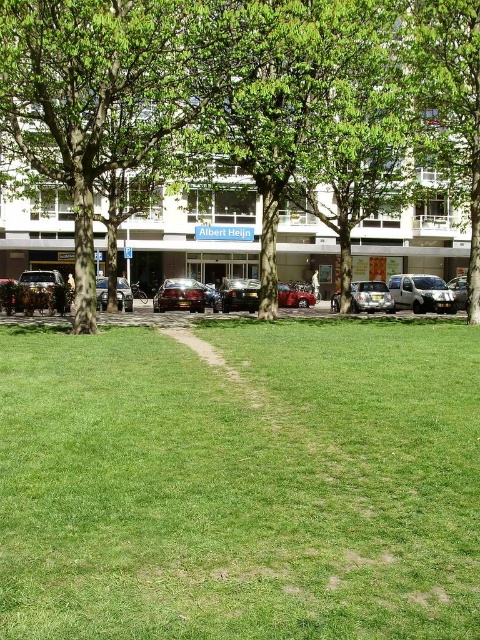
Does shiny silver car at center come in front of shiny silver sedan at center?

Yes, shiny silver car at center is in front of shiny silver sedan at center.

Who is lower down, shiny silver car at center or shiny silver sedan at center?

Positioned lower is shiny silver sedan at center.

Does point (362, 300) come closer to viewer compared to point (106, 282)?

Yes, it is in front of point (106, 282).

Where is `shiny silver car at center`? The width and height of the screenshot is (480, 640). shiny silver car at center is located at coordinates (371, 296).

Can you confirm if metallic silver van at center is positioned to the left of shiny silver car at center?

Incorrect, metallic silver van at center is not on the left side of shiny silver car at center.

Between metallic silver van at center and shiny silver car at center, which one is positioned higher?

metallic silver van at center is above.

Is point (424, 275) farther from camera compared to point (377, 282)?

Yes, point (424, 275) is behind point (377, 282).

Image resolution: width=480 pixels, height=640 pixels. Identify the location of metallic silver van at center. (420, 292).

What are the coordinates of `green grassy at center` in the screenshot? It's located at (240, 484).

Does point (101, 348) come farther from viewer compared to point (196, 284)?

No, it is in front of (196, 284).

Is point (400, 454) positioned in front of point (180, 304)?

Yes, point (400, 454) is in front of point (180, 304).

What are the coordinates of `green grassy at center` in the screenshot? It's located at (240, 484).